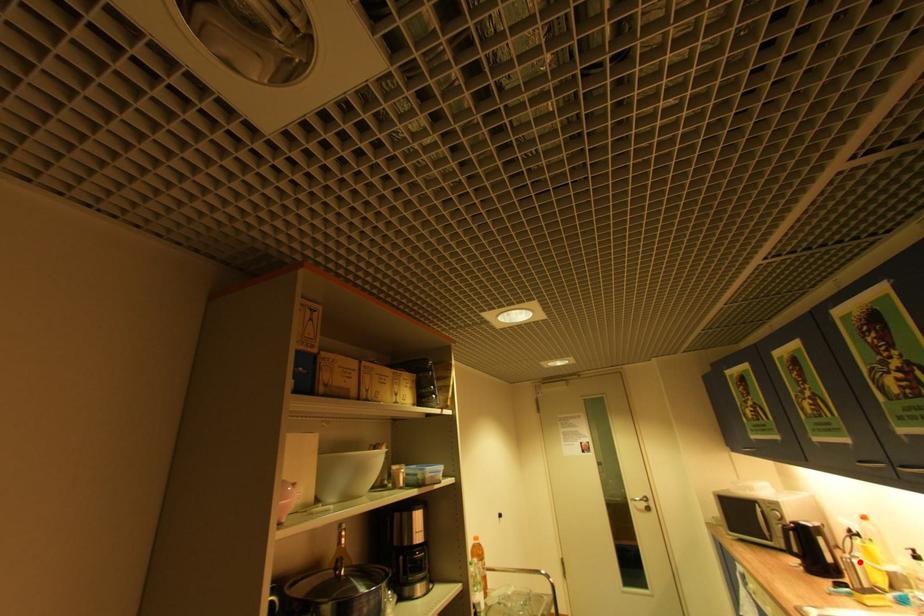
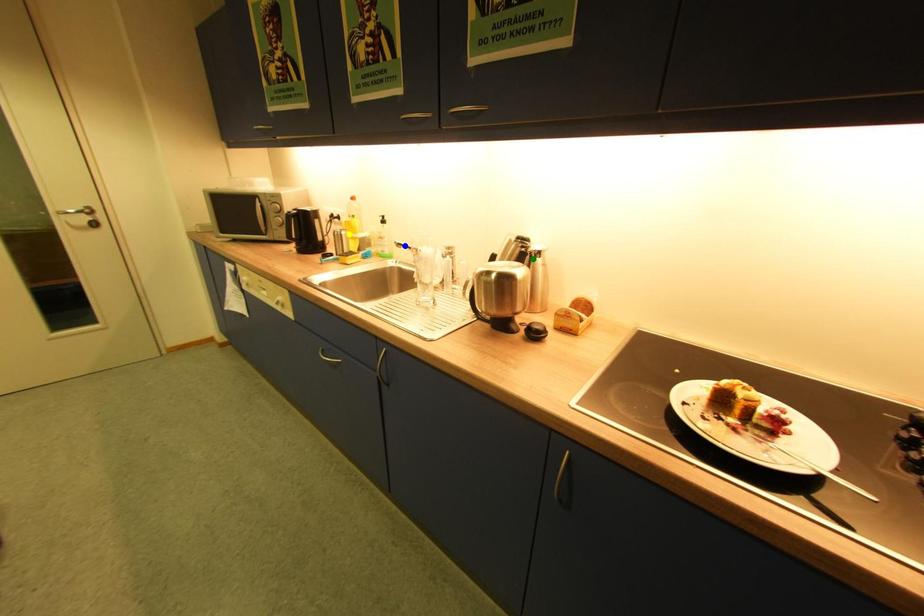
Question: I am providing you with two images of the same scene from different viewpoints. A red point is marked on the first image. You are given multiple points on the second image. Which point in image 2 is actually the same real-world point as the red point in image 1?

Choices:
 (A) yellow point
 (B) blue point
 (C) green point

Answer: (A)